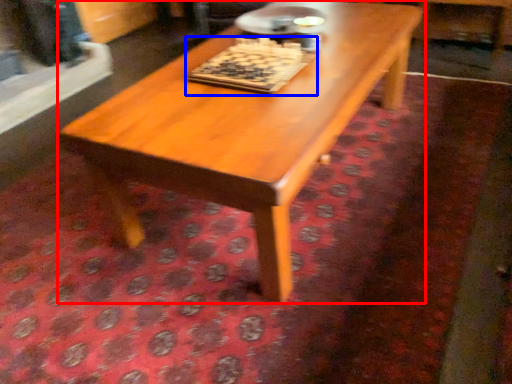
Question: Which point is closer to the camera, coffee table (highlighted by a red box) or board game (highlighted by a blue box)?

Choices:
 (A) coffee table
 (B) board game

Answer: (A)